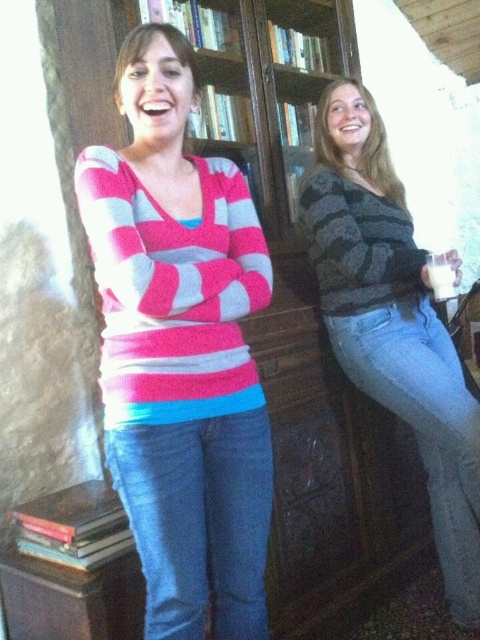
Is pink striped sweater at center smaller than striped sweater at center?

Indeed, pink striped sweater at center has a smaller size compared to striped sweater at center.

Can you confirm if pink striped sweater at center is shorter than striped sweater at center?

Indeed, pink striped sweater at center has a lesser height compared to striped sweater at center.

Between point (176, 628) and point (419, 352), which one is positioned behind?

The point (419, 352) is more distant.

Identify the location of pink striped sweater at center. The width and height of the screenshot is (480, 640). (180, 349).